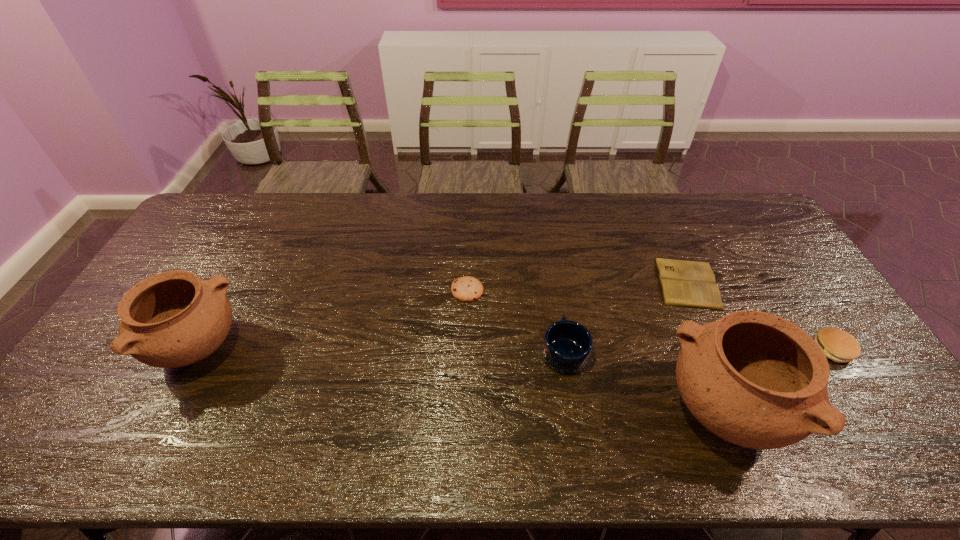
Find the location of a particular element. This screenshot has width=960, height=540. free space between the left pottery and the fifth tallest object is located at coordinates (332, 320).

You are a GUI agent. You are given a task and a screenshot of the screen. Output one action in this format:
    pyautogui.click(x=<x>, y=<y>)
    Task: Click on the unoccupied position between the fifth object from right to left and the left pottery
    Image resolution: width=960 pixels, height=540 pixels.
    Given the screenshot: What is the action you would take?
    pyautogui.click(x=332, y=320)

Where is `empty space between the second shortest object and the fifth shortest object`? Image resolution: width=960 pixels, height=540 pixels. empty space between the second shortest object and the fifth shortest object is located at coordinates (332, 320).

Image resolution: width=960 pixels, height=540 pixels. I want to click on free space between the third object from left to right and the fifth tallest object, so click(516, 321).

I want to click on vacant region between the shorter pottery and the third tallest object, so (x=380, y=350).

Where is `object that is the fourth closest to the shortest object`? This screenshot has width=960, height=540. object that is the fourth closest to the shortest object is located at coordinates (467, 288).

Identify which object is the closest to the rightmost object. Please provide its 2D coordinates. Your answer should be formatted as a tuple, i.e. [(x, y)], where the tuple contains the x and y coordinates of a point satisfying the conditions above.

[(754, 379)]

This screenshot has width=960, height=540. What are the coordinates of `vacant position in the image that satisfies the following two spatial constraints: 1. on the back side of the shortest object; 2. on the left side of the taller pottery` in the screenshot? It's located at (x=671, y=283).

Where is `vacant point that satisfies the following two spatial constraints: 1. with the handle on the side of the shortest object; 2. on the right side of the mug`? This screenshot has width=960, height=540. vacant point that satisfies the following two spatial constraints: 1. with the handle on the side of the shortest object; 2. on the right side of the mug is located at coordinates (554, 283).

Locate an element on the screen. The height and width of the screenshot is (540, 960). free space that satisfies the following two spatial constraints: 1. with the handle on the side of the shortest object; 2. on the left side of the mug is located at coordinates [554, 283].